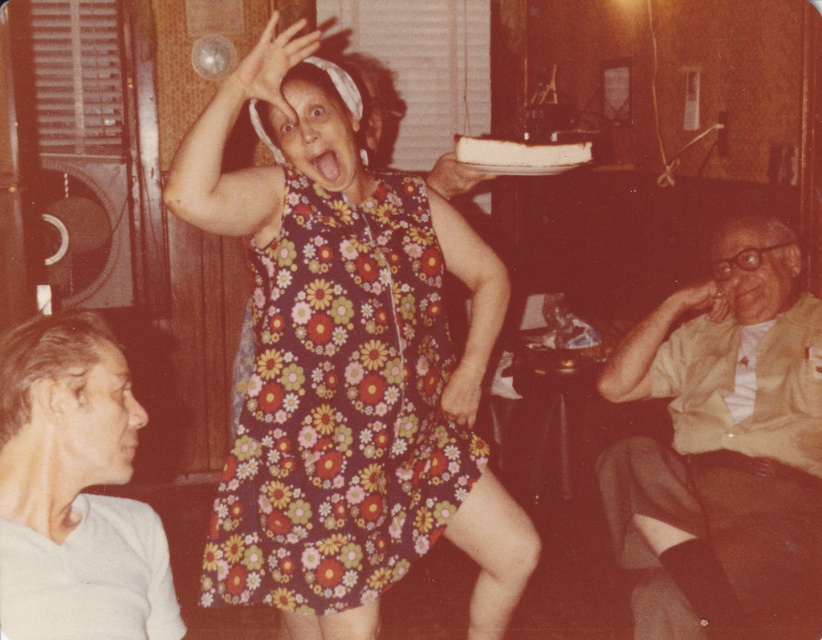
Which is in front, point (372, 326) or point (629, 465)?

Point (372, 326) is more forward.

What do you see at coordinates (340, 406) in the screenshot? This screenshot has width=822, height=640. I see `floral-patterned fabric dress at center` at bounding box center [340, 406].

Where is `floral-patterned fabric dress at center`? floral-patterned fabric dress at center is located at coordinates (340, 406).

Between floral-patterned fabric dress at center and white matte shirt at lower left, which one is positioned higher?

Positioned higher is floral-patterned fabric dress at center.

You are a GUI agent. You are given a task and a screenshot of the screen. Output one action in this format:
    pyautogui.click(x=<x>, y=<y>)
    Task: Click on the floral-patterned fabric dress at center
    This screenshot has width=822, height=640.
    Given the screenshot: What is the action you would take?
    pyautogui.click(x=340, y=406)

The width and height of the screenshot is (822, 640). Identify the location of floral-patterned fabric dress at center. (340, 406).

Is point (652, 513) closer to viewer compared to point (14, 564)?

No.

Is light beige shirt at right further to the viewer compared to white matte shirt at lower left?

Yes, it is behind white matte shirt at lower left.

Does point (682, 593) lie in front of point (119, 424)?

No, it is not.

Find the location of a particular element. light beige shirt at right is located at coordinates (724, 449).